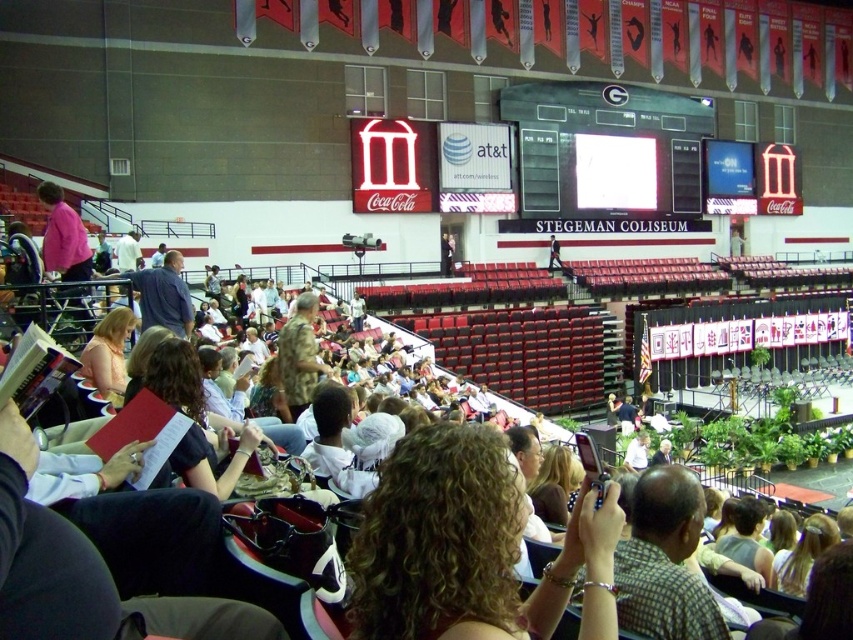
You are standing at the center of the Stegeman Coliseum and want to take a photo of both the Coca Cola logo and the scoreboard. The Coca Cola logo is located at point (666, 204) and the scoreboard is at point (321, 371). Since both are at different distances from you, which one should you focus on first to ensure both are in clear view?

Point (666, 204) is further to the camera than point (321, 371). To ensure both the Coca Cola logo and the scoreboard are in clear view, focus on the closer object first, which is the scoreboard at point (321, 371), then adjust for the Coca Cola logo at point (666, 204).